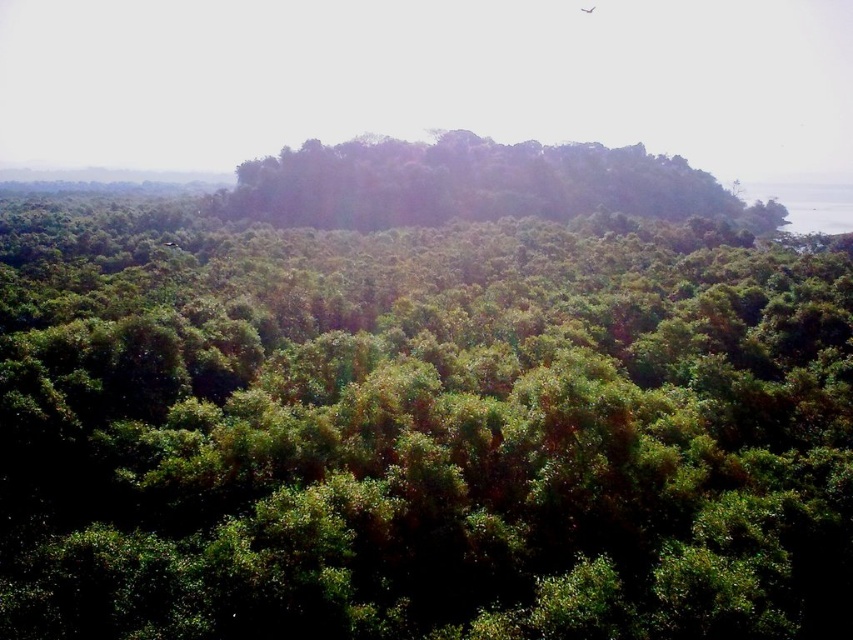
Does green leafy forest at center appear on the right side of green leafy trees at center?

In fact, green leafy forest at center is to the left of green leafy trees at center.

Which of these two, green leafy forest at center or green leafy trees at center, stands shorter?

green leafy forest at center is shorter.

Is point (137, 417) positioned before point (672, 220)?

Yes, it is.

The width and height of the screenshot is (853, 640). I want to click on green leafy forest at center, so [x=422, y=433].